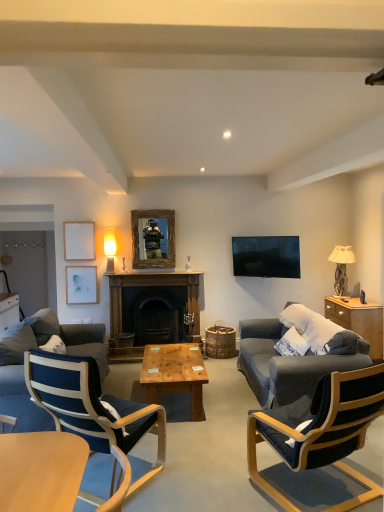
The width and height of the screenshot is (384, 512). Find the location of `free space in front of light brown wooden coffee table at center, arranged as the second coffee table when viewed from the front`. free space in front of light brown wooden coffee table at center, arranged as the second coffee table when viewed from the front is located at coordinates (201, 441).